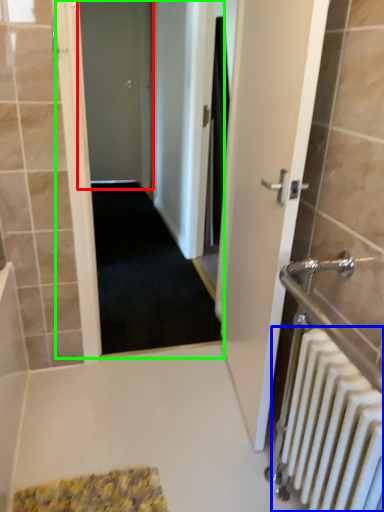
Question: Considering the real-world distances, which object is closest to door (highlighted by a red box)? radiator (highlighted by a blue box) or corridor (highlighted by a green box).

Choices:
 (A) radiator
 (B) corridor

Answer: (B)